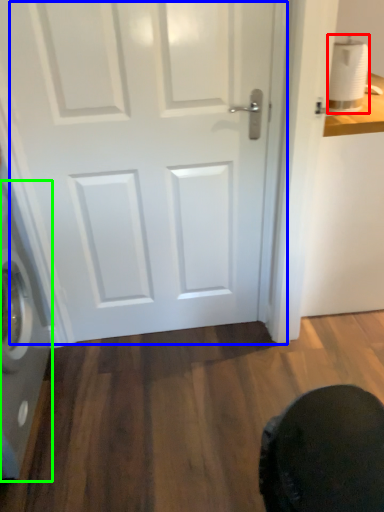
Question: Which is farther away from toilet paper (highlighted by a red box)? door (highlighted by a blue box) or washing machine (highlighted by a green box)?

Choices:
 (A) door
 (B) washing machine

Answer: (B)